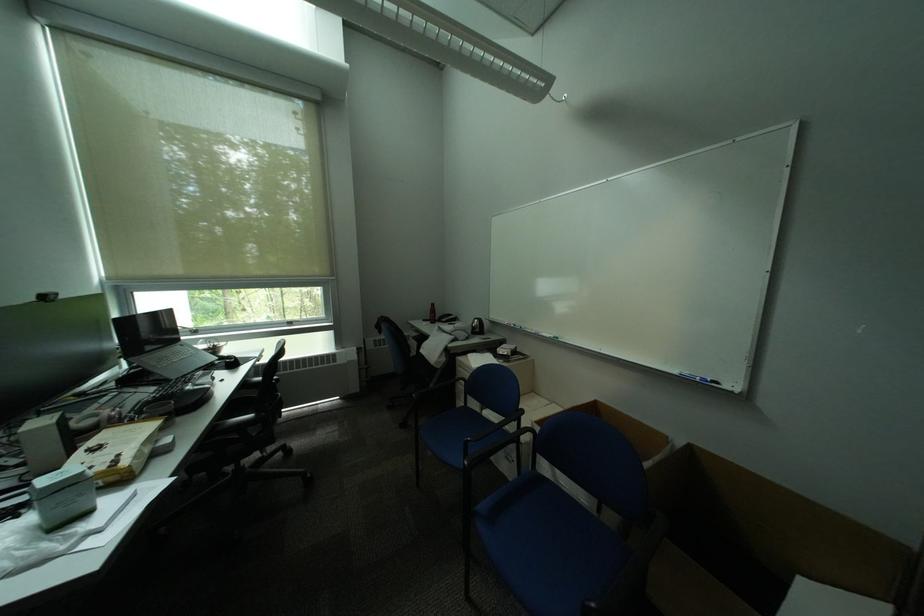
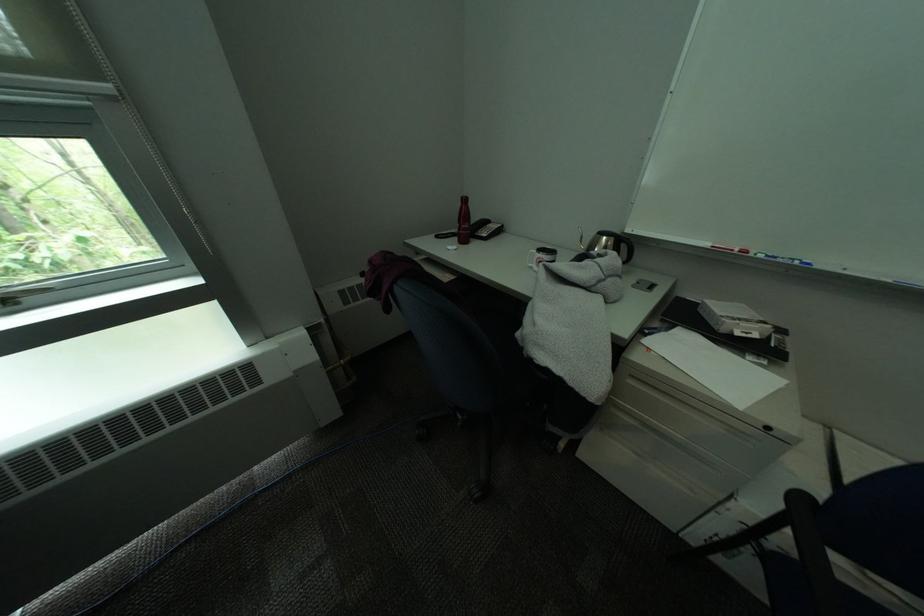
Locate, in the second image, the point that corresponds to pixel 467 330 in the first image.

(615, 274)